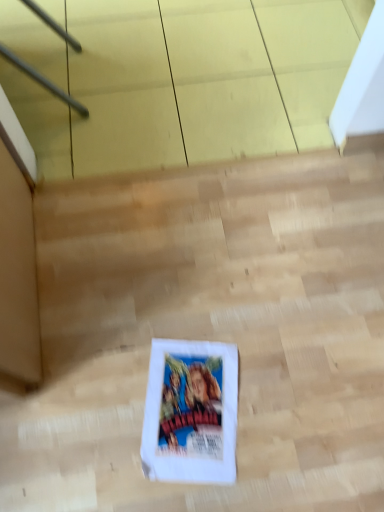
Where is `vacant area that is in front of white paper comic book at center`? This screenshot has height=512, width=384. vacant area that is in front of white paper comic book at center is located at coordinates (194, 492).